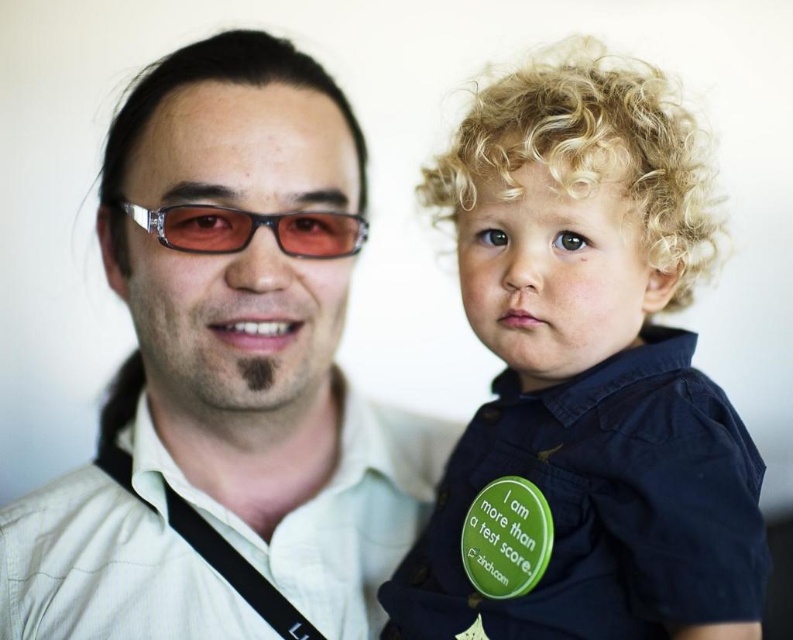
Question: Does white textured shirt at center lie behind green matte badge at right?

Choices:
 (A) yes
 (B) no

Answer: (A)

Question: Which object is positioned farthest from the matte white shirt at center?

Choices:
 (A) green matte badge at right
 (B) sunglasses at left
 (C) dark blue shirt at right

Answer: (A)

Question: Is dark blue shirt at right to the right of sunglasses at left from the viewer's perspective?

Choices:
 (A) no
 (B) yes

Answer: (B)

Question: Which of these objects is positioned farthest from the sunglasses at left?

Choices:
 (A) dark blue shirt at right
 (B) white textured shirt at center
 (C) matte white shirt at center
 (D) green matte badge at right

Answer: (B)

Question: Estimate the real-world distances between objects in this image. Which object is farther from the green matte badge at right?

Choices:
 (A) sunglasses at left
 (B) white textured shirt at center
 (C) matte white shirt at center

Answer: (C)

Question: Considering the relative positions of matte white shirt at center and green matte badge at right in the image provided, where is matte white shirt at center located with respect to green matte badge at right?

Choices:
 (A) below
 (B) above

Answer: (B)